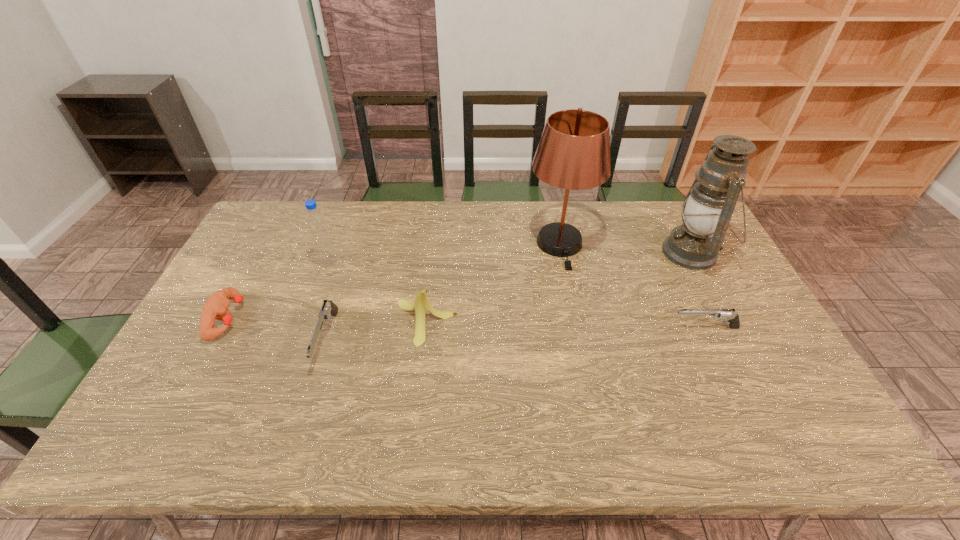
Where is `the left pistol`? the left pistol is located at coordinates (328, 308).

Find the location of a particular element. the taller pistol is located at coordinates (328, 308).

The height and width of the screenshot is (540, 960). Find the location of `the shorter pistol`. the shorter pistol is located at coordinates click(x=732, y=318).

This screenshot has height=540, width=960. Identify the location of the third object from right to left. (573, 153).

The width and height of the screenshot is (960, 540). Identify the location of oil lamp. (708, 207).

Find the location of `the sixth object from right to left`. the sixth object from right to left is located at coordinates point(316,223).

Locate an element on the screen. The width and height of the screenshot is (960, 540). water bottle is located at coordinates (316, 223).

Find the location of a particular element. This screenshot has height=540, width=960. the leftmost object is located at coordinates (216, 307).

Find the location of a particular element. the fourth object from right to left is located at coordinates (421, 303).

Where is `the fourth tallest object`? The height and width of the screenshot is (540, 960). the fourth tallest object is located at coordinates (421, 303).